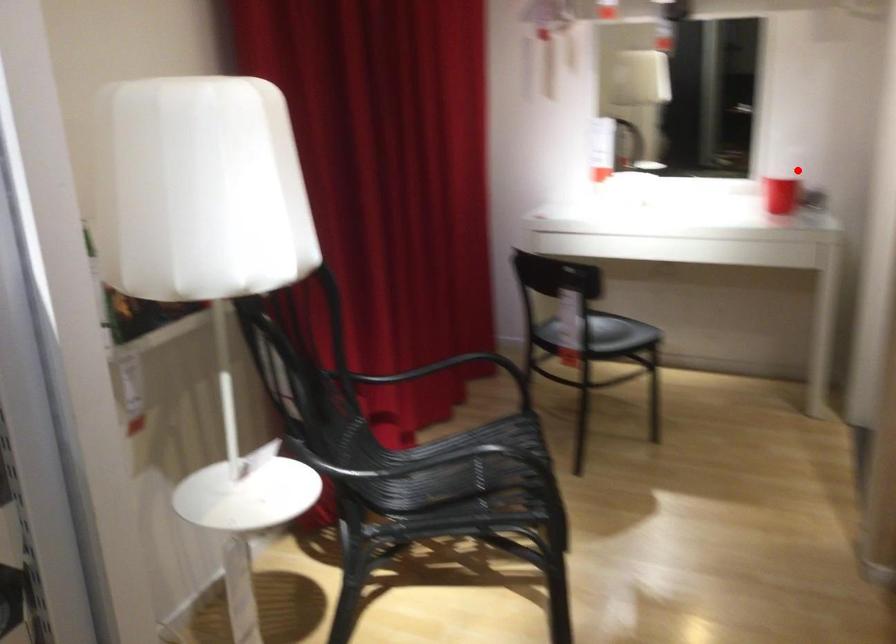
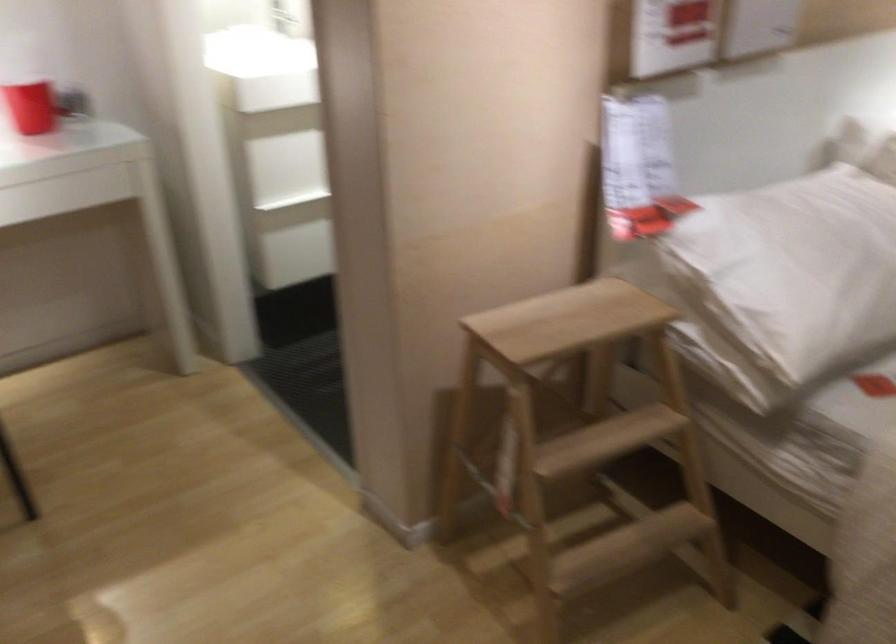
Question: A red point is marked in image1. In image2, is the corresponding 3D point closer to the camera or farther? Reply with the corresponding letter.

Choices:
 (A) The corresponding 3D point is closer.
 (B) The corresponding 3D point is farther.

Answer: (A)